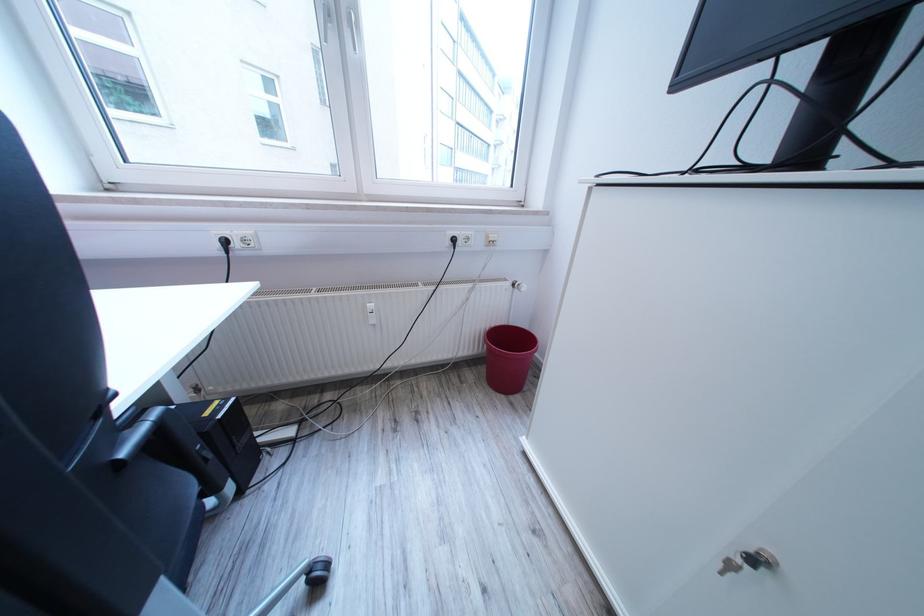
Describe the element at coordinates (136, 437) in the screenshot. I see `the chair armrest` at that location.